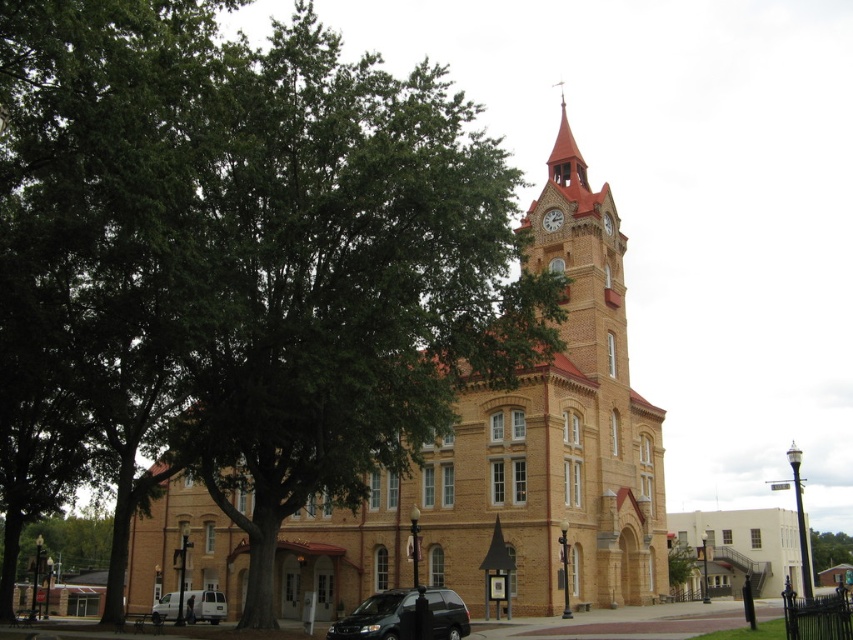
Question: Is beige brick church at center to the right of white smooth building at lower right from the viewer's perspective?

Choices:
 (A) no
 (B) yes

Answer: (A)

Question: Based on their relative distances, which object is nearer to the matte gold clock at upper center?

Choices:
 (A) white smooth building at lower right
 (B) matte black van at lower center

Answer: (B)

Question: Among these points, which one is farthest from the camera?

Choices:
 (A) (648, 568)
 (B) (611, 307)
 (C) (758, 595)

Answer: (C)

Question: Is white matte van at lower left further to camera compared to green leafy tree at center?

Choices:
 (A) yes
 (B) no

Answer: (B)

Question: Is white matte van at lower left bigger than green leafy tree at upper left?

Choices:
 (A) yes
 (B) no

Answer: (B)

Question: Considering the real-world distances, which object is closest to the green leafy tree at center?

Choices:
 (A) green leafy tree at lower left
 (B) matte black van at lower center

Answer: (B)